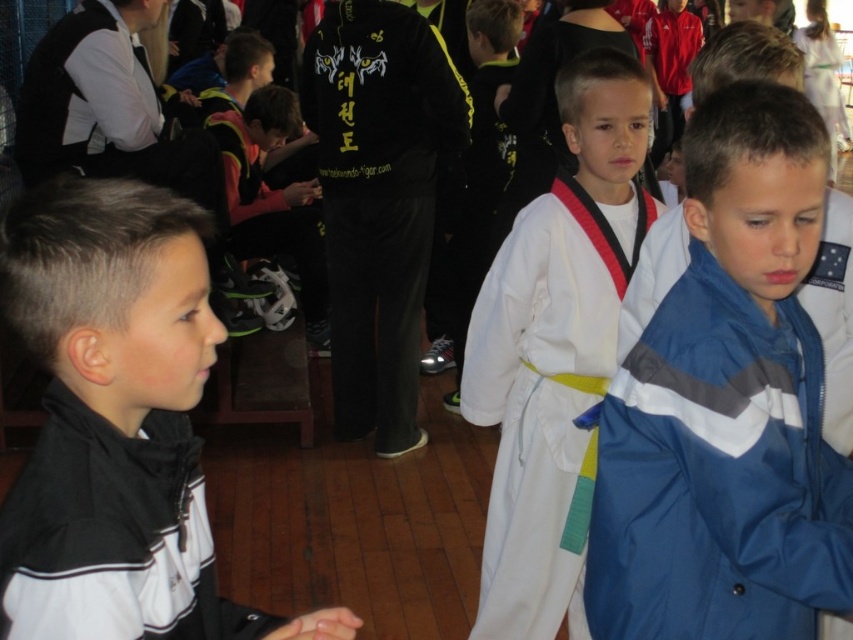
Does point (372, 342) come farther from viewer compared to point (27, 588)?

Yes, it is.

Measure the distance from velvet black robe at center to black/white jacket at left.

velvet black robe at center and black/white jacket at left are 3.08 meters apart from each other.

Does point (389, 26) come farther from viewer compared to point (166, 600)?

Yes, it is.

I want to click on velvet black robe at center, so click(x=378, y=200).

Can you confirm if blue nylon jacket at center is thinner than velvet black robe at center?

Yes, blue nylon jacket at center is thinner than velvet black robe at center.

Is blue nylon jacket at center wider than velvet black robe at center?

Incorrect, blue nylon jacket at center's width does not surpass velvet black robe at center's.

Who is more distant from viewer, [781,390] or [445,124]?

Point [445,124]

Locate an element on the screen. blue nylon jacket at center is located at coordinates (727, 404).

Consider the image. Is white cotton karate gi at center wider than black/white jacket at left?

Correct, the width of white cotton karate gi at center exceeds that of black/white jacket at left.

Between white cotton karate gi at center and black/white jacket at left, which one has more height?

Standing taller between the two is white cotton karate gi at center.

Image resolution: width=853 pixels, height=640 pixels. What are the coordinates of `white cotton karate gi at center` in the screenshot? It's located at (544, 397).